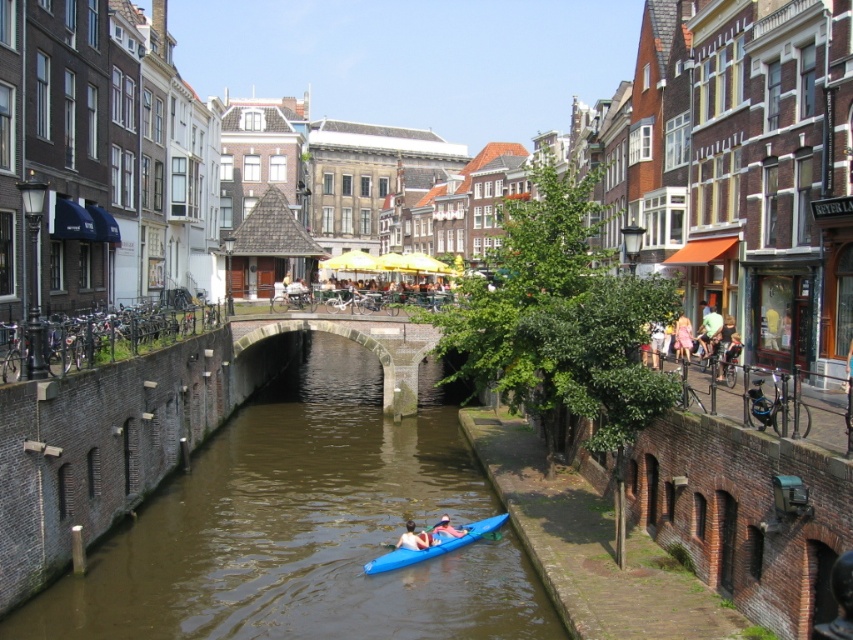
Can you confirm if light blue fabric pants at center is smaller than blue fabric jacket at center?

Yes, light blue fabric pants at center is smaller than blue fabric jacket at center.

Can you confirm if light blue fabric pants at center is bigger than blue fabric jacket at center?

No.

What are the coordinates of `light blue fabric pants at center` in the screenshot? It's located at (708, 330).

Is light blue fabric pants at center to the left of pink fabric dress at right from the viewer's perspective?

In fact, light blue fabric pants at center is to the right of pink fabric dress at right.

Can you confirm if light blue fabric pants at center is wider than pink fabric dress at right?

No.

You are a GUI agent. You are given a task and a screenshot of the screen. Output one action in this format:
    pyautogui.click(x=<x>, y=<y>)
    Task: Click on the light blue fabric pants at center
    The height and width of the screenshot is (640, 853).
    Given the screenshot: What is the action you would take?
    pyautogui.click(x=708, y=330)

Does point (675, 348) come farther from viewer compared to point (425, 536)?

Yes, point (675, 348) is farther from viewer.

Does pink fabric dress at right appear on the right side of light blue kayak at lower center?

Indeed, pink fabric dress at right is positioned on the right side of light blue kayak at lower center.

Who is more forward, (x=683, y=330) or (x=405, y=531)?

Positioned in front is point (x=405, y=531).

Where is `pink fabric dress at right`? The height and width of the screenshot is (640, 853). pink fabric dress at right is located at coordinates (682, 337).